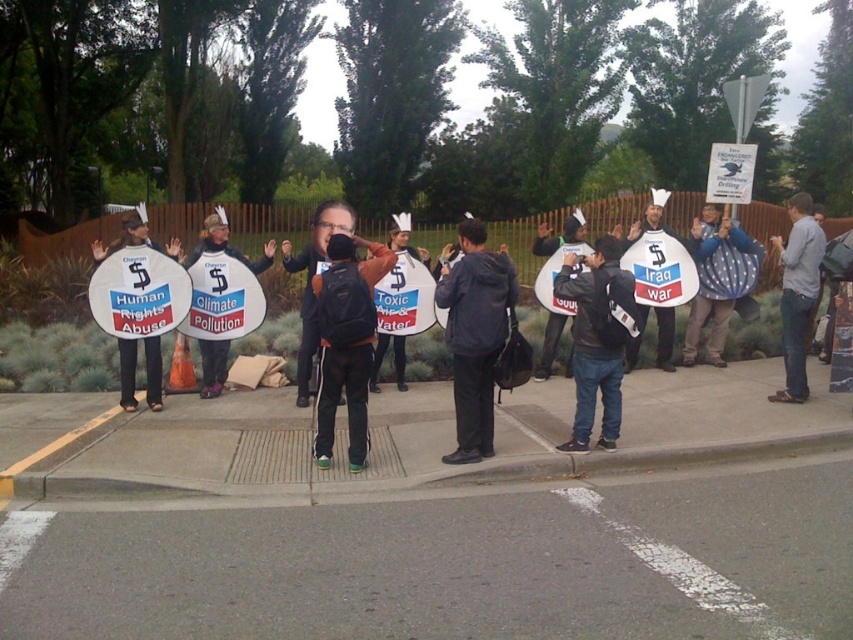
Question: Which object is the farthest from the white paper bag at center?

Choices:
 (A) white paper sign at center
 (B) gray fabric shirt at right
 (C) dark blue jacket at center
 (D) orange fabric jacket at center

Answer: (B)

Question: Is orange fabric jacket at center bigger than white paper bag at center?

Choices:
 (A) no
 (B) yes

Answer: (B)

Question: Which point is farther to the camera?

Choices:
 (A) white cardboard sign at center
 (B) white paper bag at center
 (C) dark blue jacket at center
 (D) white paper sign at center

Answer: (D)

Question: Based on their relative distances, which object is farther from the orange fabric jacket at center?

Choices:
 (A) dark gray jacket at center
 (B) white cardboard sign at center
 (C) gray fabric shirt at right

Answer: (C)

Question: Where is white cardboard sign at center located in relation to white paper bag at center in the image?

Choices:
 (A) right
 (B) left

Answer: (B)

Question: Can you confirm if dark blue jacket at center is thinner than white paper bag at center?

Choices:
 (A) no
 (B) yes

Answer: (A)